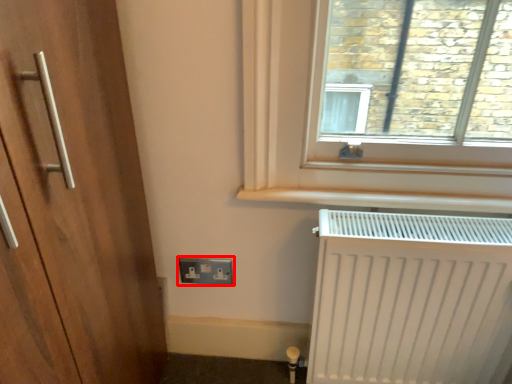
Question: Where is electric outlet (annotated by the red box) located in relation to radiator in the image?

Choices:
 (A) right
 (B) left

Answer: (B)